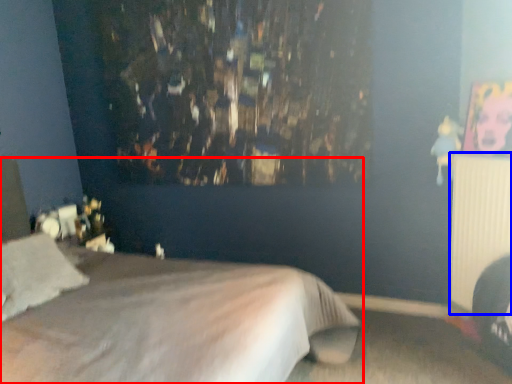
Question: Which point is further to the camera, bed (highlighted by a red box) or radiator (highlighted by a blue box)?

Choices:
 (A) bed
 (B) radiator

Answer: (B)